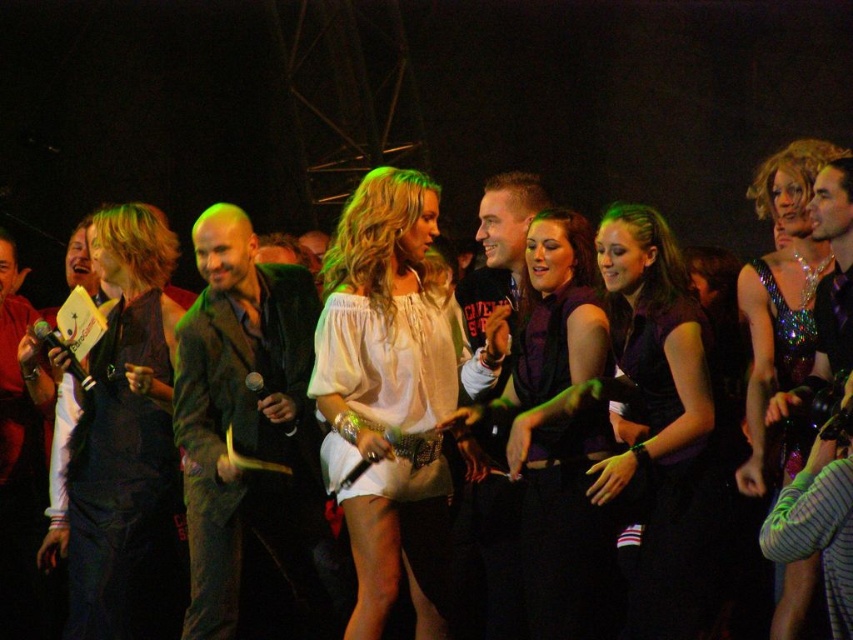
Question: Does velvet green jacket at center have a greater width compared to sparkly sequined dress at center?

Choices:
 (A) yes
 (B) no

Answer: (A)

Question: Estimate the real-world distances between objects in this image. Which object is closer to the matte black dress at center?

Choices:
 (A) velvet purple dress at center
 (B) velvet green jacket at center
 (C) white fabric dress at center
 (D) sparkly sequined dress at center

Answer: (A)

Question: Is matte black vest at left thinner than velvet purple dress at center?

Choices:
 (A) no
 (B) yes

Answer: (B)

Question: Estimate the real-world distances between objects in this image. Which object is closer to the matte black dress at center?

Choices:
 (A) velvet purple dress at center
 (B) sparkly sequined dress at center
 (C) white fabric dress at center

Answer: (A)

Question: Among these objects, which one is nearest to the camera?

Choices:
 (A) matte black dress at center
 (B) matte black vest at left
 (C) velvet green jacket at center

Answer: (A)

Question: Does matte black dress at center lie in front of sparkly sequined dress at center?

Choices:
 (A) yes
 (B) no

Answer: (B)